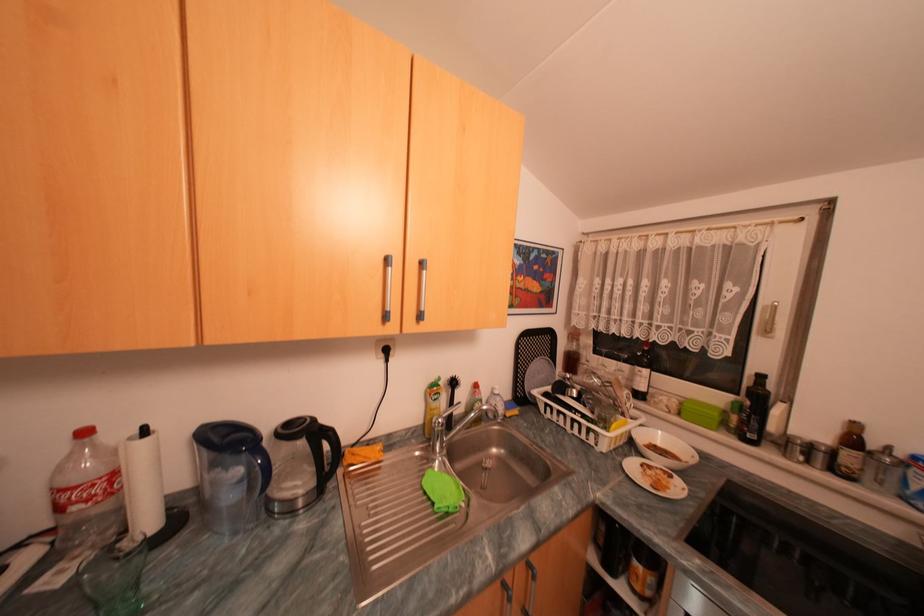
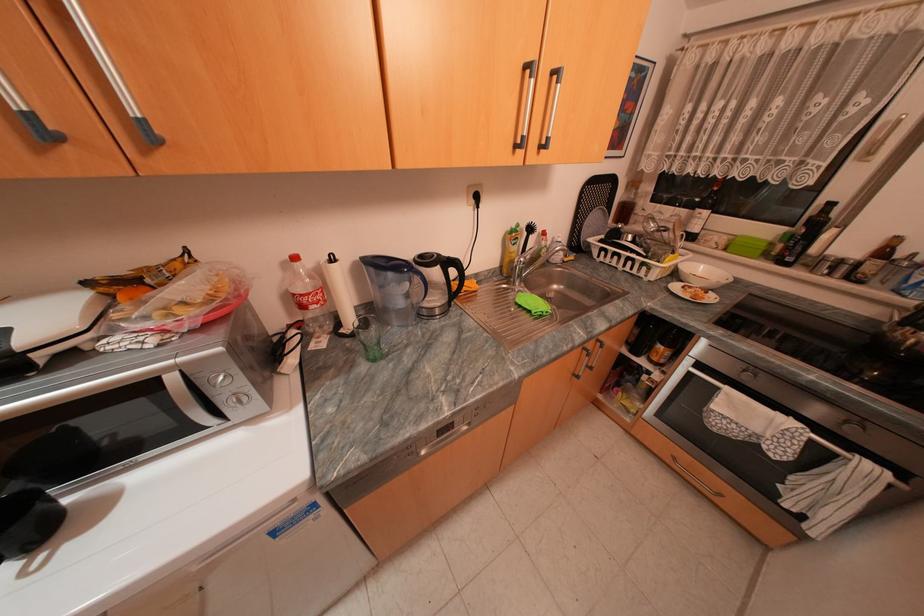
Find the pixel in the second image that matches (x=422, y=432) in the first image.

(503, 273)